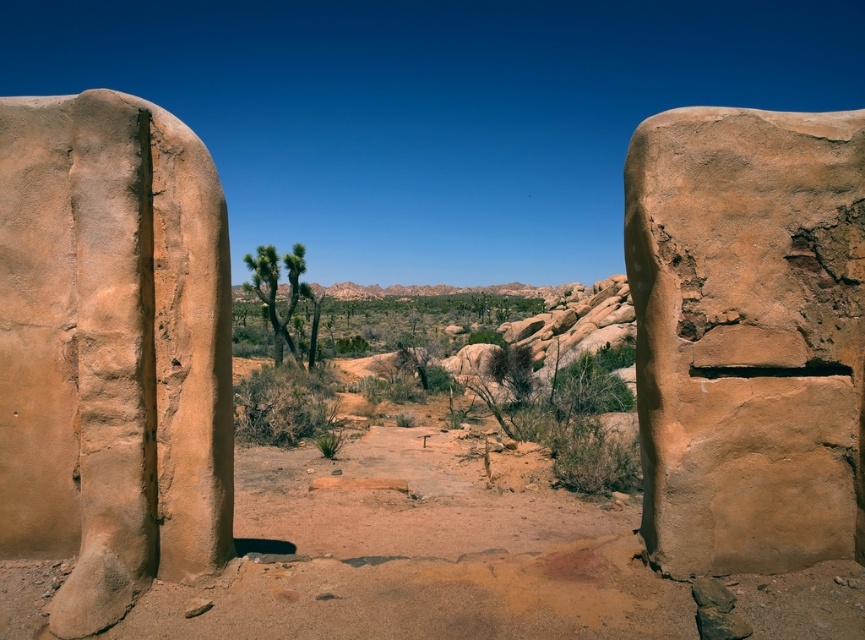
You are standing in the desert scene and want to walk from the point at coordinate (22, 525) to the point at coordinate (684, 518). Which direction should you face to move towards the second point?

Since point (22, 525) is closer to you than point (684, 518), you should face downwards to move towards the second point.

You are an explorer in the desert and need to decide which rock formation to climb first. The matte sandstone rock at left and the matte sandstone boulder at right are both in your path. Which one has a wider base for easier climbing?

The matte sandstone rock at left has a wider base than the matte sandstone boulder at right, making it easier to climb.